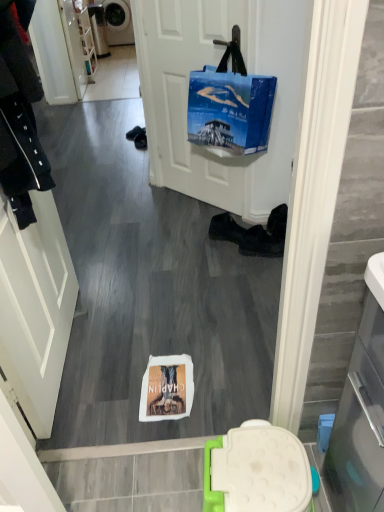
At what (x,y) coordinates should I click in order to perform the action: click on free area in between white matte door at center and white paper bag at center. Please return your answer as a coordinate pair (x, y). This screenshot has width=384, height=512. Looking at the image, I should click on (177, 264).